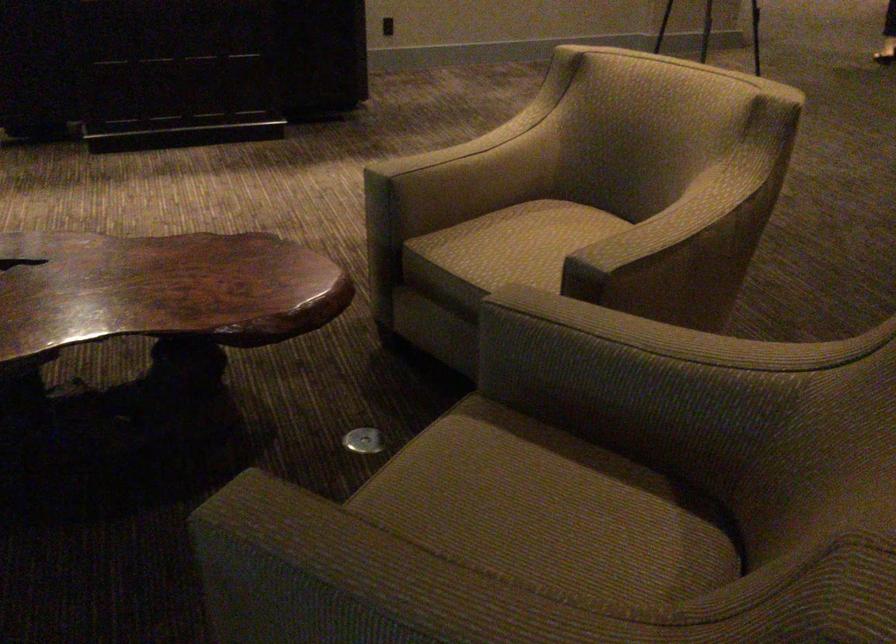
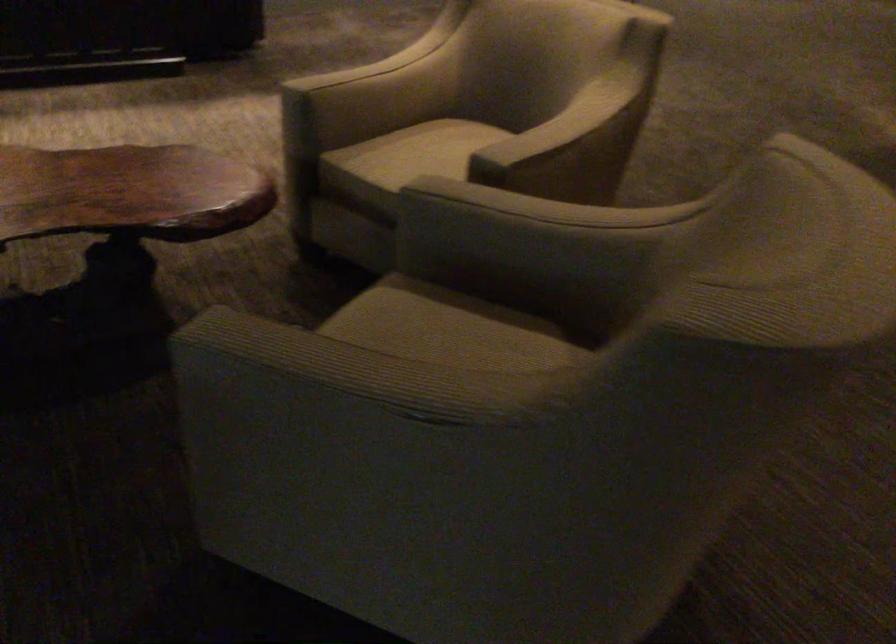
Question: What movement of the cameraman would produce the second image?

Choices:
 (A) Left
 (B) Right
 (C) Forward
 (D) Backward

Answer: (D)